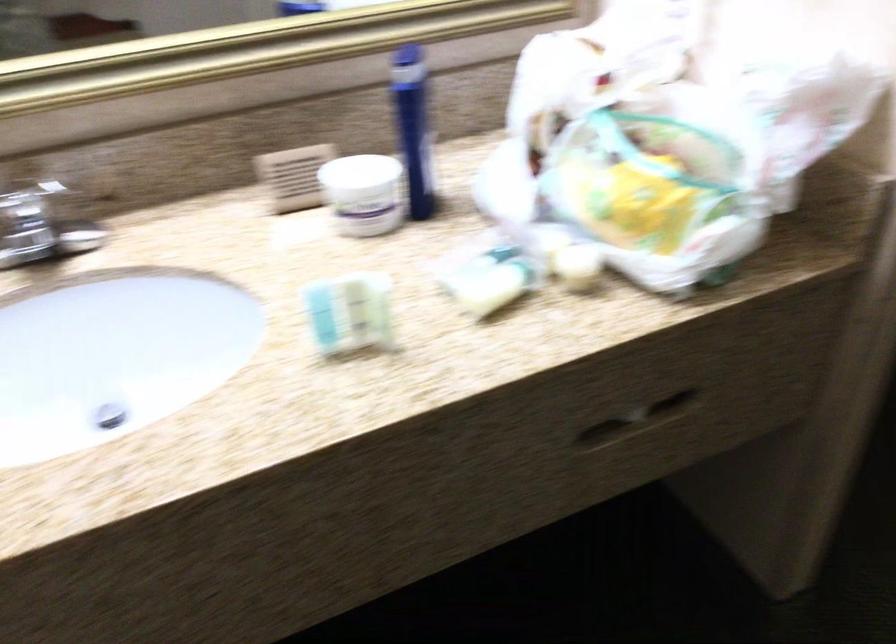
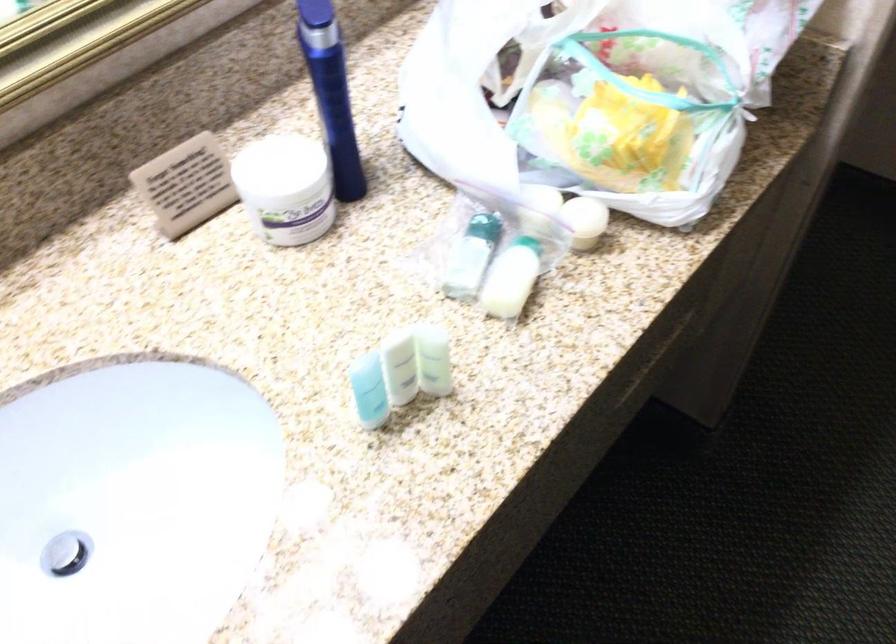
The point at (380, 308) is marked in the first image. Where is the corresponding point in the second image?

(433, 360)